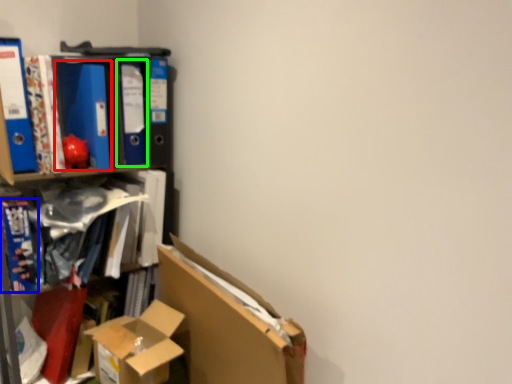
Question: Considering the real-world distances, which object is farthest from paperback book (highlighted by a red box)? book (highlighted by a blue box) or paperback book (highlighted by a green box)?

Choices:
 (A) book
 (B) paperback book

Answer: (A)